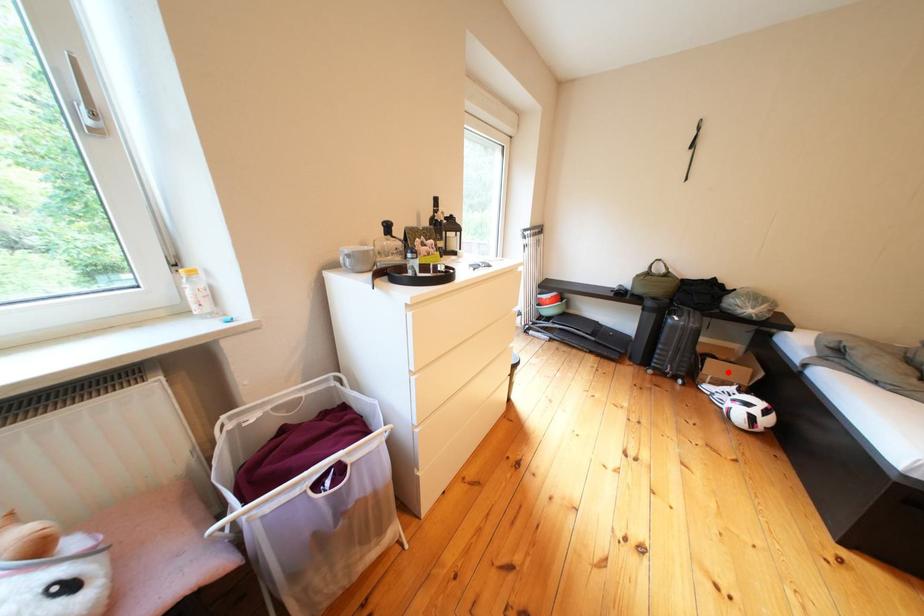
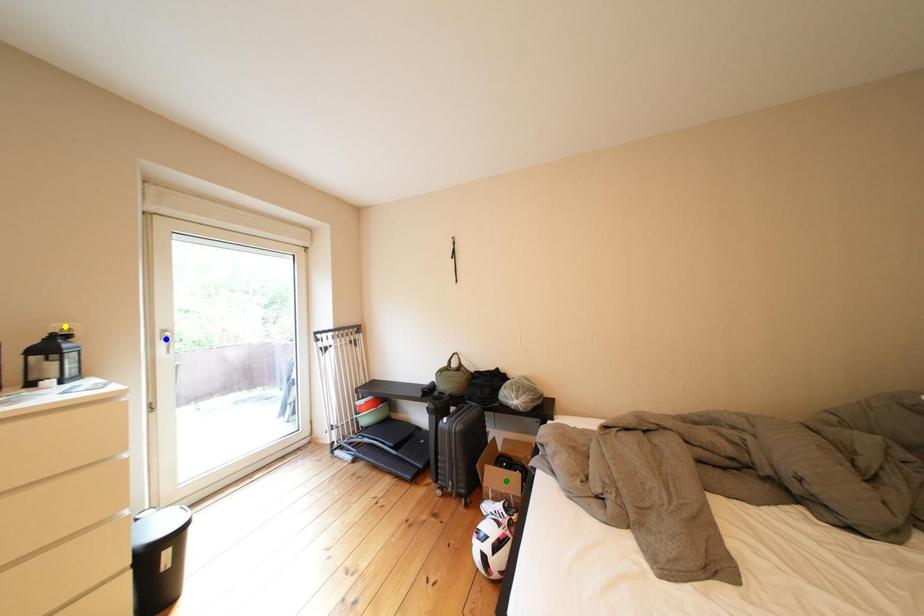
Question: I am providing you with two images of the same scene from different viewpoints. A red point is marked on the first image. You are given multiple points on the second image. Which spot in image 2 lines up with the point in image 1?

Choices:
 (A) yellow point
 (B) blue point
 (C) green point

Answer: (C)